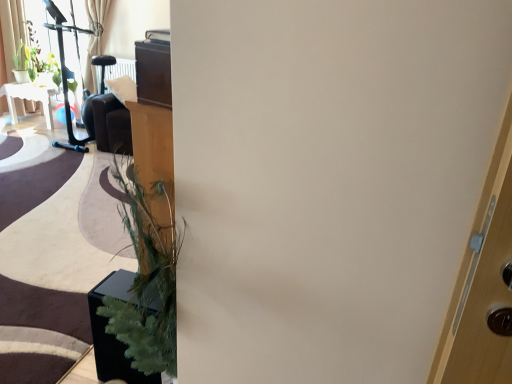
Locate an element on the screen. light beige fabric curtain at upper left is located at coordinates (11, 31).

Describe the element at coordinates (113, 334) in the screenshot. The width and height of the screenshot is (512, 384). I see `green artificial plant at lower left` at that location.

The image size is (512, 384). Describe the element at coordinates (25, 63) in the screenshot. I see `green matte plant at upper left, the first plant viewed from the left` at that location.

This screenshot has height=384, width=512. What are the coordinates of `white glossy table at upper left` in the screenshot? It's located at (29, 99).

Can you confirm if green matte plant at upper left, the second plant positioned from the right, is smaller than white glossy table at upper left?

Yes, green matte plant at upper left, the second plant positioned from the right, is smaller than white glossy table at upper left.

Is point (28, 62) positioned after point (16, 123)?

Yes, point (28, 62) is behind point (16, 123).

From a real-world perspective, is green matte plant at upper left, the first plant viewed from the left, positioned under white glossy table at upper left based on gravity?

No, from a real-world perspective, green matte plant at upper left, the first plant viewed from the left, is not under white glossy table at upper left.

From the image's perspective, is green matte plant at upper left, the first plant viewed from the left, located above white glossy table at upper left?

Yes, from the image's perspective, green matte plant at upper left, the first plant viewed from the left, is on top of white glossy table at upper left.

Is light beige fabric curtain at upper left smaller than white glossy table at upper left?

Yes, light beige fabric curtain at upper left is smaller than white glossy table at upper left.

Considering the positions of objects light beige fabric curtain at upper left and white glossy table at upper left in the image provided, who is more to the right, light beige fabric curtain at upper left or white glossy table at upper left?

From the viewer's perspective, white glossy table at upper left appears more on the right side.

Is light beige fabric curtain at upper left positioned beyond the bounds of white glossy table at upper left?

Absolutely, light beige fabric curtain at upper left is external to white glossy table at upper left.

Considering the positions of points (1, 108) and (45, 90), is point (1, 108) farther from camera compared to point (45, 90)?

No, it is not.

Considering the relative sizes of white glossy table at upper left and green matte plant at upper left, marked as the second plant in a left-to-right arrangement, in the image provided, is white glossy table at upper left wider than green matte plant at upper left, marked as the second plant in a left-to-right arrangement,?

Yes, white glossy table at upper left is wider than green matte plant at upper left, marked as the second plant in a left-to-right arrangement.

Who is taller, white glossy table at upper left or green matte plant at upper left, marked as the second plant in a left-to-right arrangement?

Standing taller between the two is green matte plant at upper left, marked as the second plant in a left-to-right arrangement.

Can you confirm if white glossy table at upper left is positioned to the left of green matte plant at upper left, the first plant in the right-to-left sequence?

Yes.

Does white glossy table at upper left have a larger size compared to green matte plant at upper left, the first plant in the right-to-left sequence?

Indeed, white glossy table at upper left has a larger size compared to green matte plant at upper left, the first plant in the right-to-left sequence.

Considering the sizes of objects white glossy table at upper left and green artificial plant at lower left in the image provided, who is thinner, white glossy table at upper left or green artificial plant at lower left?

Thinner between the two is green artificial plant at lower left.

Consider the image. Considering the relative sizes of white glossy table at upper left and green artificial plant at lower left in the image provided, is white glossy table at upper left bigger than green artificial plant at lower left?

Yes, white glossy table at upper left is bigger than green artificial plant at lower left.

Measure the distance between white glossy table at upper left and green artificial plant at lower left.

white glossy table at upper left is 3.67 meters from green artificial plant at lower left.

Which is more to the left, white glossy table at upper left or green artificial plant at lower left?

Positioned to the left is white glossy table at upper left.

Which is nearer, (22, 52) or (22, 80)?

Positioned in front is point (22, 52).

Is green matte plant at upper left, the first plant in the right-to-left sequence, behind green matte plant at upper left, the second plant positioned from the right?

No, the depth of green matte plant at upper left, the first plant in the right-to-left sequence, is less than that of green matte plant at upper left, the second plant positioned from the right.

Find the location of a particular element. The width and height of the screenshot is (512, 384). plant above the green matte plant at upper left, the first plant viewed from the left (from a real-world perspective) is located at coordinates (36, 63).

Does green matte plant at upper left, the first plant in the right-to-left sequence, have a greater width compared to green matte plant at upper left, the first plant viewed from the left?

Yes.

From the image's perspective, is white glossy table at upper left above or below light beige fabric curtain at upper left?

white glossy table at upper left is situated lower than light beige fabric curtain at upper left in the image.

From a real-world perspective, who is located lower, white glossy table at upper left or light beige fabric curtain at upper left?

white glossy table at upper left is physically lower.

Would you say white glossy table at upper left is to the left or to the right of light beige fabric curtain at upper left in the picture?

Clearly, white glossy table at upper left is on the right of light beige fabric curtain at upper left in the image.

Which point is more forward, [39,68] or [120,354]?

Point [120,354]

Is green matte plant at upper left, marked as the second plant in a left-to-right arrangement, facing towards green artificial plant at lower left?

No.

Identify the location of furniture below the green matte plant at upper left, the first plant in the right-to-left sequence (from a real-world perspective). (113, 334).

Consider the image. Is green matte plant at upper left, marked as the second plant in a left-to-right arrangement, shorter than green artificial plant at lower left?

In fact, green matte plant at upper left, marked as the second plant in a left-to-right arrangement, may be taller than green artificial plant at lower left.

You are a GUI agent. You are given a task and a screenshot of the screen. Output one action in this format:
    pyautogui.click(x=<x>, y=<y>)
    Task: Click on the table that is on the right side of green matte plant at upper left, the second plant positioned from the right
    
    Given the screenshot: What is the action you would take?
    pyautogui.click(x=29, y=99)

Find the location of a particular element. This screenshot has width=512, height=384. curtain above the white glossy table at upper left (from the image's perspective) is located at coordinates (11, 31).

From the image, which object appears to be farther from green matte plant at upper left, the first plant in the right-to-left sequence, green artificial plant at lower left or white glossy table at upper left?

green artificial plant at lower left is further to green matte plant at upper left, the first plant in the right-to-left sequence.

When comparing their distances from green artificial plant at lower left, does green matte plant at upper left, the second plant positioned from the right, or white glossy table at upper left seem closer?

Based on the image, white glossy table at upper left appears to be nearer to green artificial plant at lower left.

Which object lies further to the anchor point white glossy table at upper left, green matte plant at upper left, the first plant viewed from the left, or light beige fabric curtain at upper left?

light beige fabric curtain at upper left is positioned further to the anchor white glossy table at upper left.

Looking at the image, which one is located further to green matte plant at upper left, the second plant positioned from the right, green matte plant at upper left, the first plant in the right-to-left sequence, or white glossy table at upper left?

white glossy table at upper left lies further to green matte plant at upper left, the second plant positioned from the right, than the other object.

Based on their spatial positions, is green artificial plant at lower left or white glossy table at upper left further from light beige fabric curtain at upper left?

green artificial plant at lower left lies further to light beige fabric curtain at upper left than the other object.

Which object lies nearer to the anchor point green artificial plant at lower left, light beige fabric curtain at upper left or white glossy table at upper left?

Answer: Among the two, white glossy table at upper left is located nearer to green artificial plant at lower left.

From the image, which object appears to be farther from green matte plant at upper left, the first plant viewed from the left, green artificial plant at lower left or light beige fabric curtain at upper left?

Based on the image, green artificial plant at lower left appears to be further to green matte plant at upper left, the first plant viewed from the left.

When comparing their distances from light beige fabric curtain at upper left, does green artificial plant at lower left or green matte plant at upper left, the first plant in the right-to-left sequence, seem further?

green artificial plant at lower left lies further to light beige fabric curtain at upper left than the other object.

Identify the location of table between green artificial plant at lower left and green matte plant at upper left, the second plant positioned from the right, along the z-axis. The image size is (512, 384). (29, 99).

Where is `curtain between green artificial plant at lower left and white glossy table at upper left from front to back`? The width and height of the screenshot is (512, 384). curtain between green artificial plant at lower left and white glossy table at upper left from front to back is located at coordinates (11, 31).

The width and height of the screenshot is (512, 384). Identify the location of plant between light beige fabric curtain at upper left and green matte plant at upper left, the first plant in the right-to-left sequence, from left to right. (25, 63).

The height and width of the screenshot is (384, 512). What are the coordinates of `plant between green artificial plant at lower left and green matte plant at upper left, the first plant viewed from the left, from front to back` in the screenshot? It's located at (36, 63).